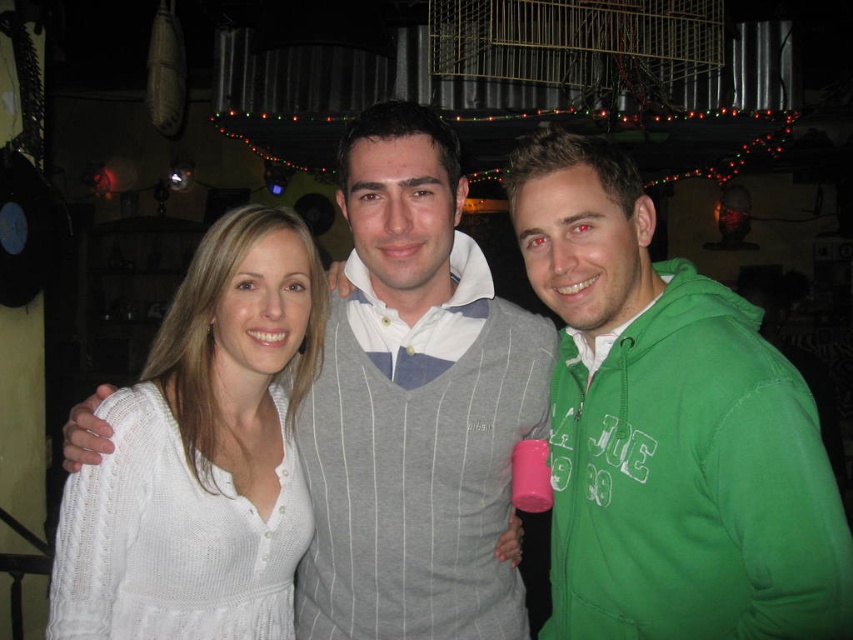
You are standing in front of the group photo and want to point out two specific points. The first point is at coordinates point (x=579, y=516) and the second is at point (x=287, y=426). Which of these two points is nearer to you?

Point (x=579, y=516) is closer to the viewer than point (x=287, y=426).

You are a photographer trying to adjust the lighting for a group photo. You notice the green fleece jacket at right and the white knitted sweater at center. Which one requires more vertical space in the frame to avoid cropping?

The green fleece jacket at right requires more vertical space in the frame since it has a greater height compared to the white knitted sweater at center, so adjusting the frame to accommodate its height will prevent cropping.

You are trying to decide which clothing item to take with you for a chilly evening. You see the green fleece jacket at right and the white knitted sweater at center in the image. Based on their sizes, which one would be more suitable for carrying in a small bag?

The green fleece jacket at right is bigger than the white knitted sweater at center, so the white knitted sweater at center would be more suitable for carrying in a small bag since it is smaller in size.